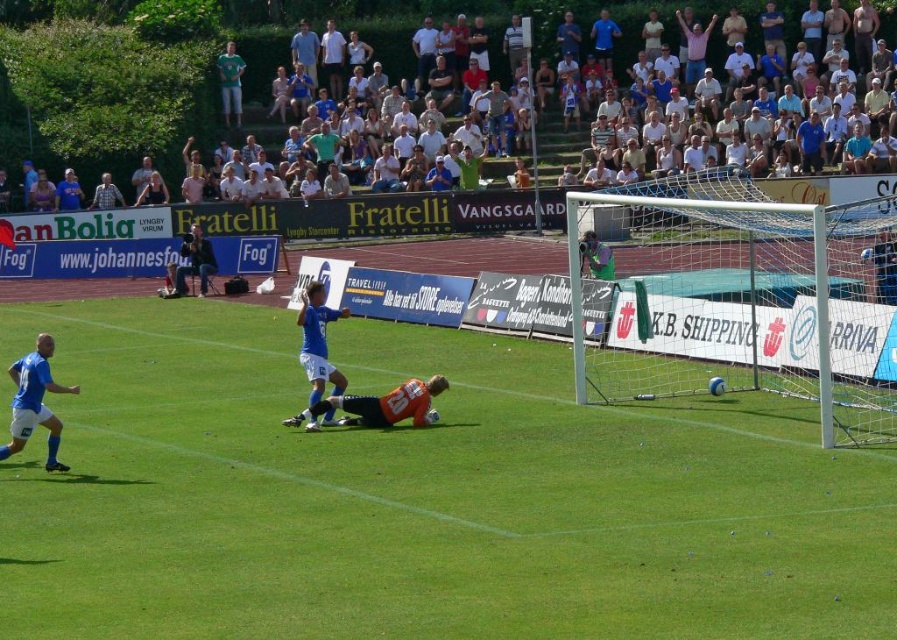
You are a soccer coach analyzing the game from the sidelines. You notice two points marked in the image at coordinates point (434, 577) and point (25, 433). Which point is nearer to your vantage point as the coach?

Point (434, 577) is closer to the camera than point (25, 433).

You are a drone operator trying to capture aerial footage of the soccer match. You need to ensure the green grass football field at center and the gray shirt at upper center are both visible in the shot. Based on their heights, which object should appear larger in the frame?

The green grass football field at center has a greater height compared to the gray shirt at upper center, so it will appear larger in the frame.

You are a soccer coach analyzing the game. You need to determine if the blue jersey at left can reach the green grass football field at center within 2 seconds if they sprint at a speed of 4 meters per second. Is it possible?

The distance between the blue jersey at left and the green grass football field at center is 3.94 meters. Since the player can sprint 4 meters in 2 seconds, they can cover the distance in less than 2 seconds. Therefore, yes, the blue jersey at left can reach the green grass football field at center within 2 seconds.